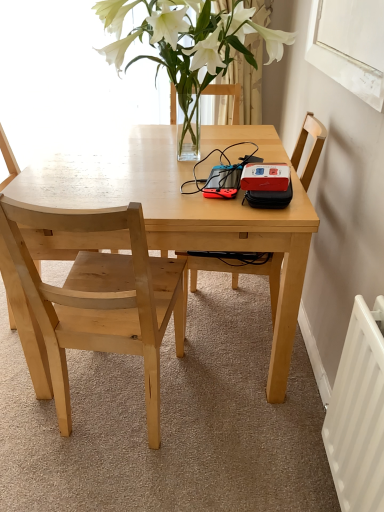
In order to click on free space between light wood chair at left, the 2th chair viewed from the right, and light wood table at center in this screenshot , I will do `click(191, 421)`.